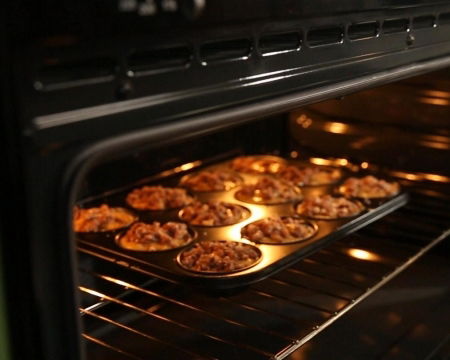
This screenshot has width=450, height=360. Find the location of `stove vent holes`. stove vent holes is located at coordinates (78, 68), (159, 58), (222, 51), (276, 41), (323, 34), (366, 32), (392, 23), (420, 23), (445, 20).